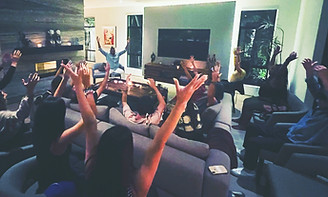
The height and width of the screenshot is (197, 328). I want to click on wall, so click(x=177, y=14).